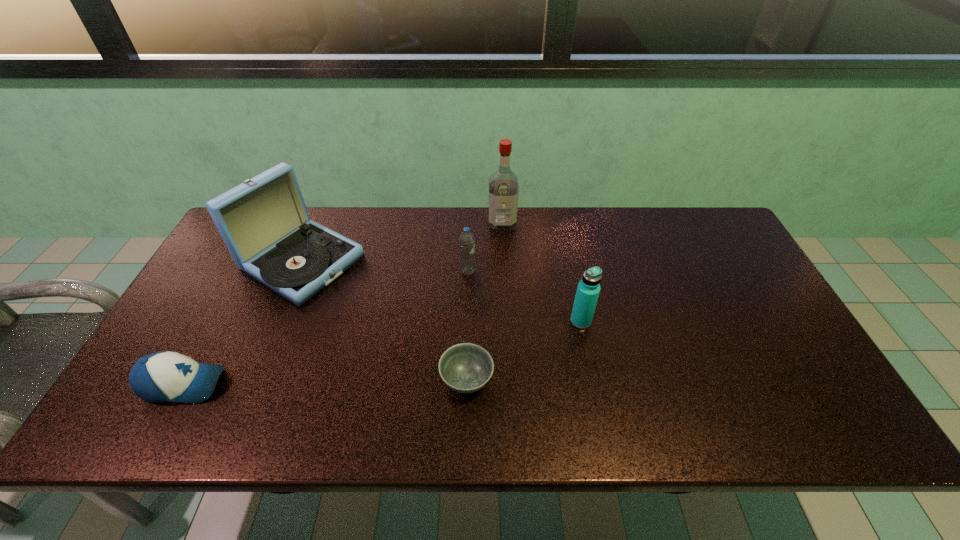
The width and height of the screenshot is (960, 540). In order to click on vacant space situated 0.050m on the front of the nearer water bottle in this screenshot , I will do `click(586, 345)`.

What are the coordinates of `blank space located on the front of the third shortest object` in the screenshot? It's located at (465, 388).

Image resolution: width=960 pixels, height=540 pixels. I want to click on free space located on the front-facing side of the second shortest object, so click(x=304, y=384).

Find the location of a particular element. The height and width of the screenshot is (540, 960). free space located on the left of the bowl is located at coordinates (310, 380).

You are a GUI agent. You are given a task and a screenshot of the screen. Output one action in this format:
    pyautogui.click(x=<x>, y=<y>)
    Task: Click on the liquor positioned at the far edge
    This screenshot has height=540, width=960.
    Given the screenshot: What is the action you would take?
    pyautogui.click(x=503, y=184)

Identify the location of phonograph record located at the far edge. The height and width of the screenshot is (540, 960). (264, 222).

Find the location of a particular element. The width and height of the screenshot is (960, 540). baseball cap that is at the near edge is located at coordinates (166, 376).

Identify the location of bowl located at the near edge. (466, 368).

Locate an element on the screen. This screenshot has width=960, height=540. phonograph record located at the left edge is located at coordinates (264, 222).

You are a GUI agent. You are given a task and a screenshot of the screen. Output one action in this format:
    pyautogui.click(x=<x>, y=<y>)
    Task: Click on the baseball cap that is at the left edge
    The width and height of the screenshot is (960, 540).
    Given the screenshot: What is the action you would take?
    pyautogui.click(x=166, y=376)